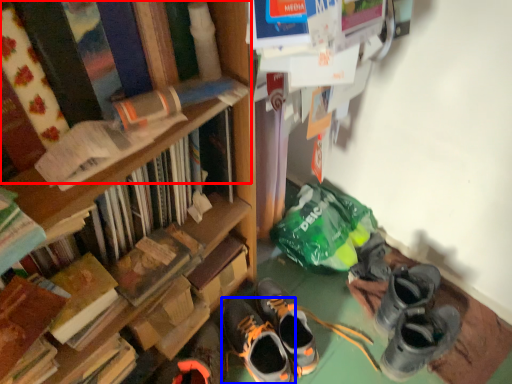
Question: Which object is further to the camera taking this photo, book (highlighted by a red box) or footwear (highlighted by a blue box)?

Choices:
 (A) book
 (B) footwear

Answer: (B)